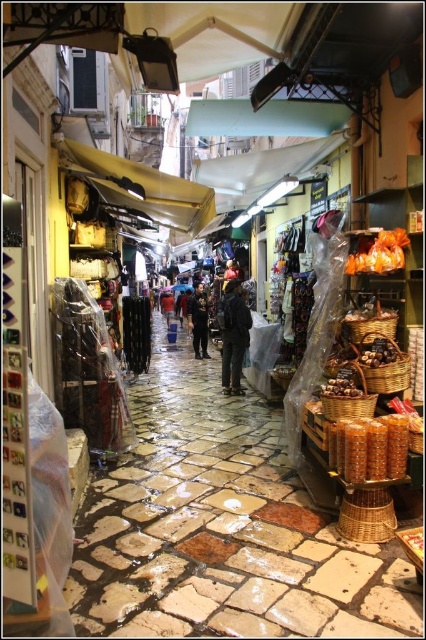
Question: Which point appears closest to the camera in this image?

Choices:
 (A) (385, 344)
 (B) (203, 340)
 (C) (360, 392)
 (D) (351, 435)

Answer: (D)

Question: Can you confirm if matte wicker basket at center is positioned to the right of brown matte nuts at center-right?

Choices:
 (A) yes
 (B) no

Answer: (B)

Question: Considering the real-world distances, which object is farthest from the matte wicker basket at center?

Choices:
 (A) brown matte mushrooms at center
 (B) translucent plastic bag at center

Answer: (A)

Question: Which is farther from the dark gray fabric jacket at center?

Choices:
 (A) brown matte mushrooms at center
 (B) translucent plastic bag at center

Answer: (B)

Question: From the image, what is the correct spatial relationship of matte wicker basket at center in relation to brown matte nuts at center-right?

Choices:
 (A) above
 (B) below

Answer: (B)

Question: Is black leather pants at center above dark blue jeans at center?

Choices:
 (A) no
 (B) yes

Answer: (A)